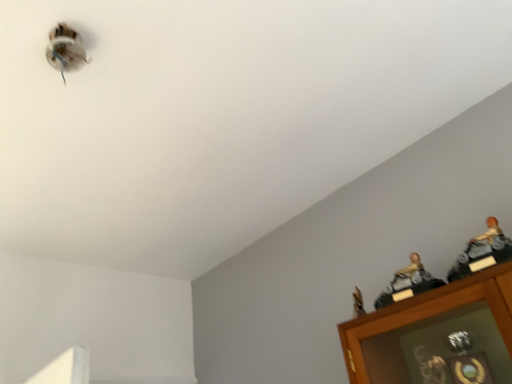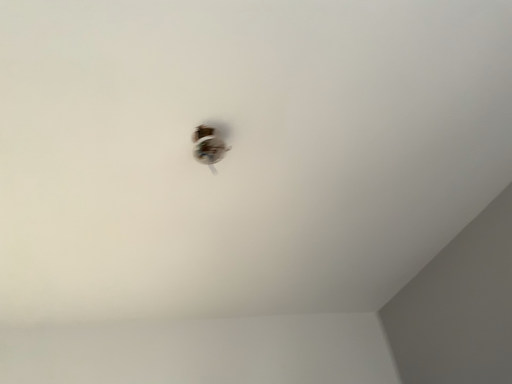
Question: How did the camera likely rotate when shooting the video?

Choices:
 (A) rotated right
 (B) rotated left

Answer: (B)